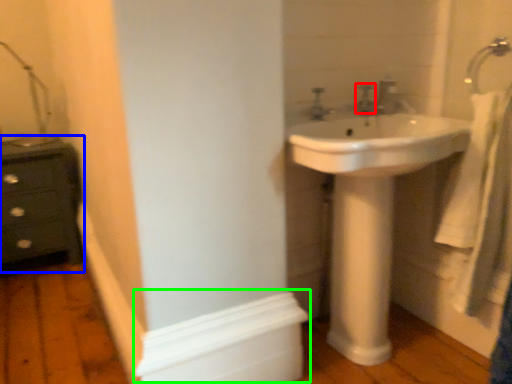
Question: Estimate the real-world distances between objects in this image. Which object is farther from plumbing fixture (highlighted by a red box), chest of drawers (highlighted by a blue box) or molding (highlighted by a green box)?

Choices:
 (A) chest of drawers
 (B) molding

Answer: (A)